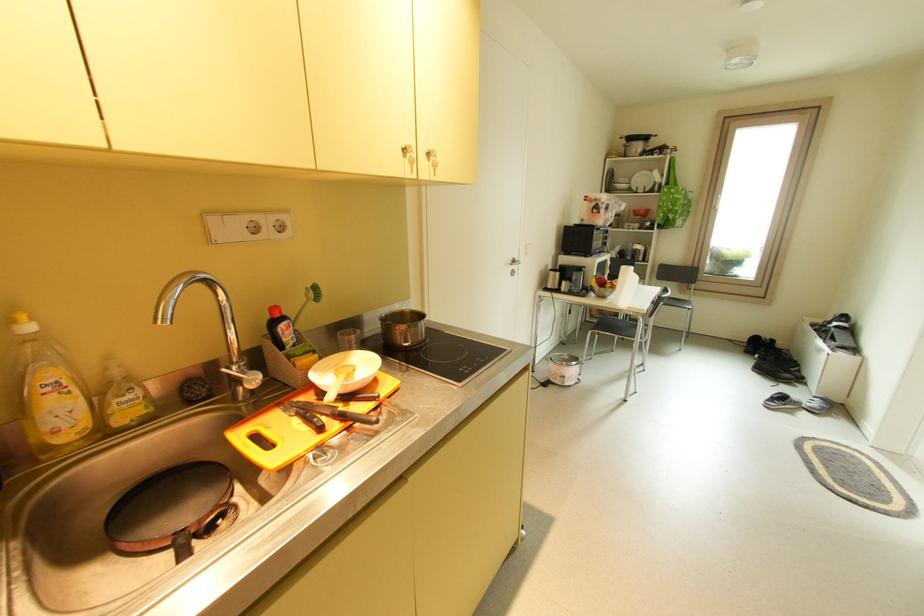
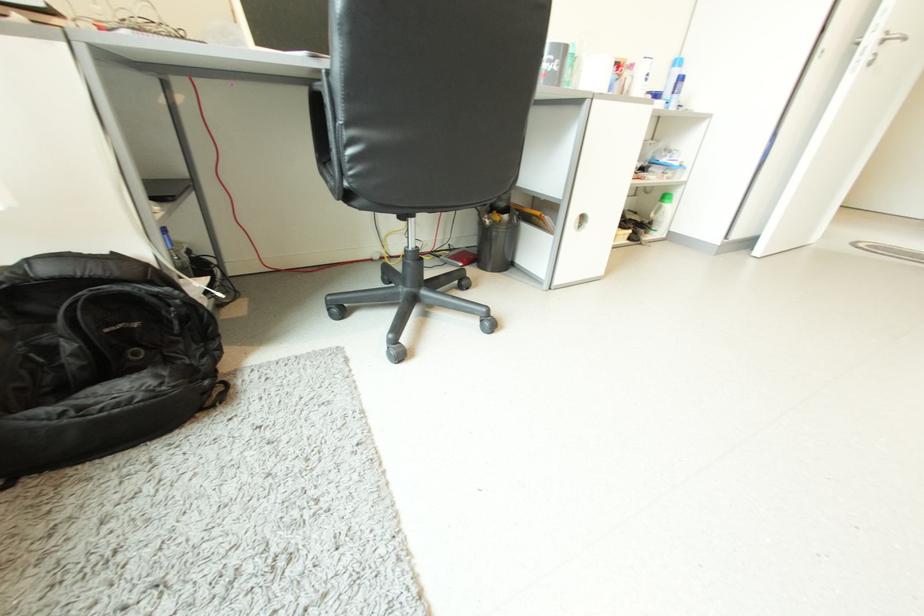
Question: I am providing you with two images of the same scene from different viewpoints. Please identify which objects are invisible in image2.

Choices:
 (A) red smartphone
 (B) sink faucet handle
 (C) blue aerosol can
 (D) white cosmetic bottle

Answer: (B)